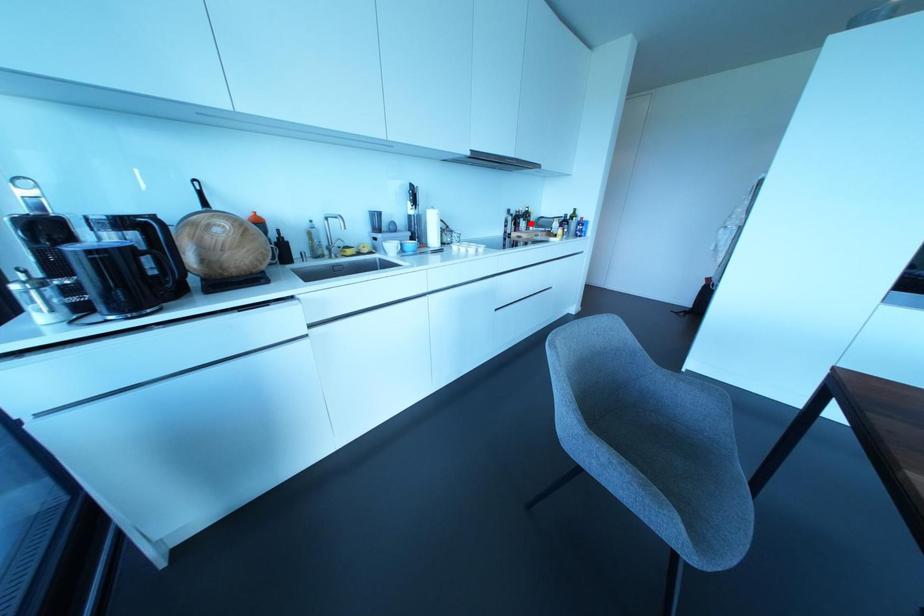
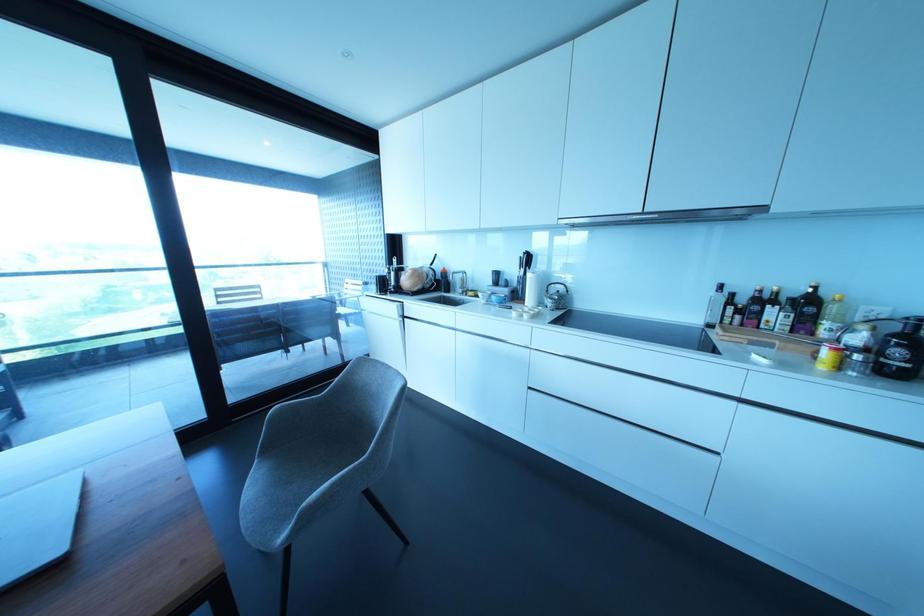
Question: I am providing you with two images of the same scene from different viewpoints. Given a red point in image1, look at the same physical point in image2. Is it:

Choices:
 (A) Closer to the viewpoint
 (B) Farther from the viewpoint

Answer: (B)